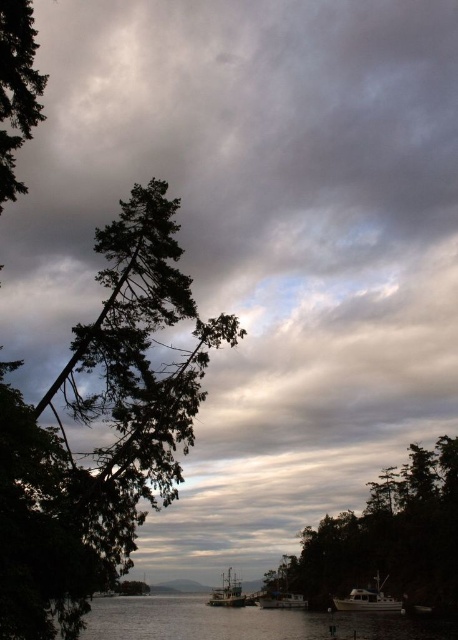
Can you confirm if dark green leafy tree at left is smaller than wooden fishing boat at lower center?

Yes.

Does point (0, 134) come closer to viewer compared to point (349, 604)?

Yes, it is.

Where is `dark green leafy tree at left`? The height and width of the screenshot is (640, 458). dark green leafy tree at left is located at coordinates (16, 90).

The image size is (458, 640). What are the coordinates of `transparent water at lower center` in the screenshot? It's located at (244, 621).

The height and width of the screenshot is (640, 458). In order to click on transparent water at lower center in this screenshot , I will do `click(244, 621)`.

Identify the location of transparent water at lower center. This screenshot has height=640, width=458. (244, 621).

Is transparent water at lower center bigger than white matte boat at center?

Yes, transparent water at lower center is bigger than white matte boat at center.

Is point (234, 611) less distant than point (294, 595)?

That is False.

Does point (119, 637) come farther from viewer compared to point (272, 605)?

That is False.

Where is `transparent water at lower center`? transparent water at lower center is located at coordinates (244, 621).